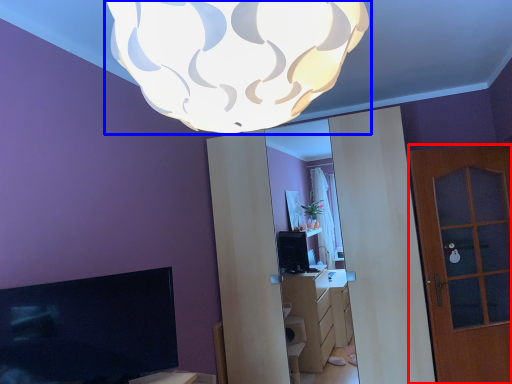
Question: Which object is closer to the camera taking this photo, door (highlighted by a red box) or lamp (highlighted by a blue box)?

Choices:
 (A) door
 (B) lamp

Answer: (B)